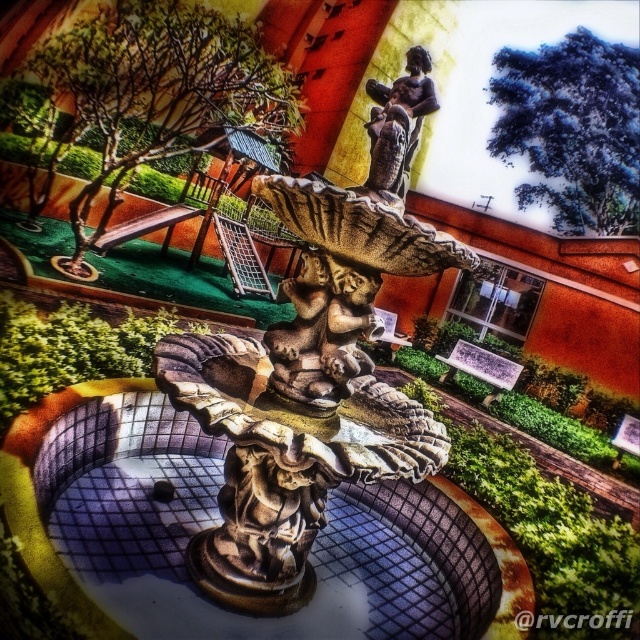
You are standing in front of the stone fountain at center and the bronze statue at center. Which object is closer to you?

The stone fountain at center is closer to you because it is in front of the bronze statue at center.

You are a visitor at the park and see the stone fountain at center and the bronze statue at center. Which one is located to the left?

The stone fountain at center is positioned on the left side of bronze statue at center, so the stone fountain at center is located to the left.

You are an artist planning to sketch the fountain and statue. Given that the stone fountain at center is larger than the bronze statue at center, which one should you focus on first to capture the scale relationship accurately?

Since the stone fountain at center is larger than the bronze statue at center, you should focus on sketching the stone fountain at center first to establish the scale before adding the smaller bronze statue at center.